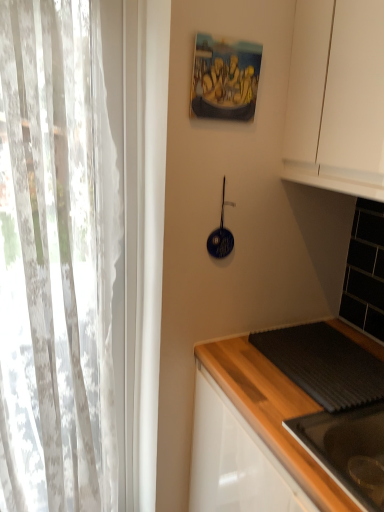
The width and height of the screenshot is (384, 512). Identify the location of empty space that is ontop of black glossy sink at lower right (from a real-world perspective). (351, 425).